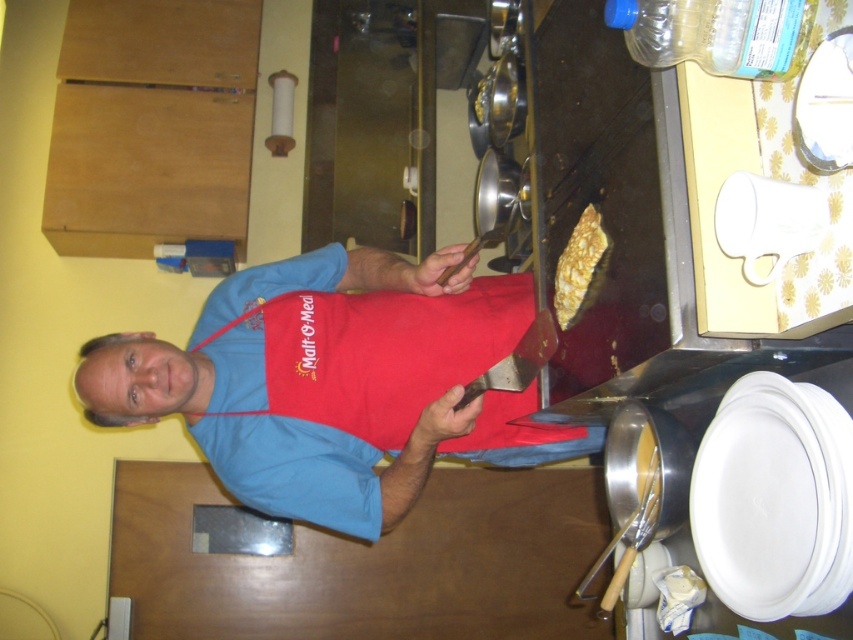
Can you confirm if blue fabric apron at center is thinner than golden crispy pancake at upper right?

Incorrect, blue fabric apron at center's width is not less than golden crispy pancake at upper right's.

You are a GUI agent. You are given a task and a screenshot of the screen. Output one action in this format:
    pyautogui.click(x=<x>, y=<y>)
    Task: Click on the blue fabric apron at center
    
    Given the screenshot: What is the action you would take?
    pyautogui.click(x=335, y=381)